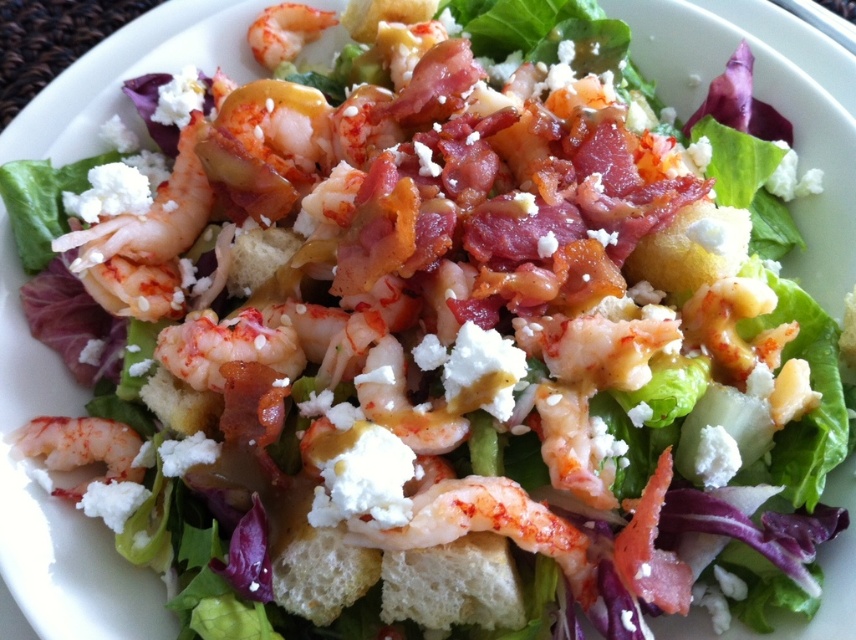
Question: Can you confirm if white crumbly shrimp at center is positioned below white crumbly cheese at center?

Choices:
 (A) no
 (B) yes

Answer: (B)

Question: Which point is farther to the camera?

Choices:
 (A) (294, 38)
 (B) (397, 452)

Answer: (A)

Question: Does white crumbly cheese at center lie in front of pinkish-white raw shrimp at lower left?

Choices:
 (A) yes
 (B) no

Answer: (A)

Question: Which object is closer to the camera taking this photo?

Choices:
 (A) white crumbly shrimp at center
 (B) pink glossy shrimp at upper center

Answer: (A)

Question: Which point is farther to the camera?

Choices:
 (A) pinkish-white raw shrimp at lower left
 (B) white crumbly shrimp at center
 (C) white crumbly cheese at center
 (D) pink glossy shrimp at upper center

Answer: (D)

Question: Can you confirm if white crumbly shrimp at center is thinner than pink glossy shrimp at upper center?

Choices:
 (A) no
 (B) yes

Answer: (A)